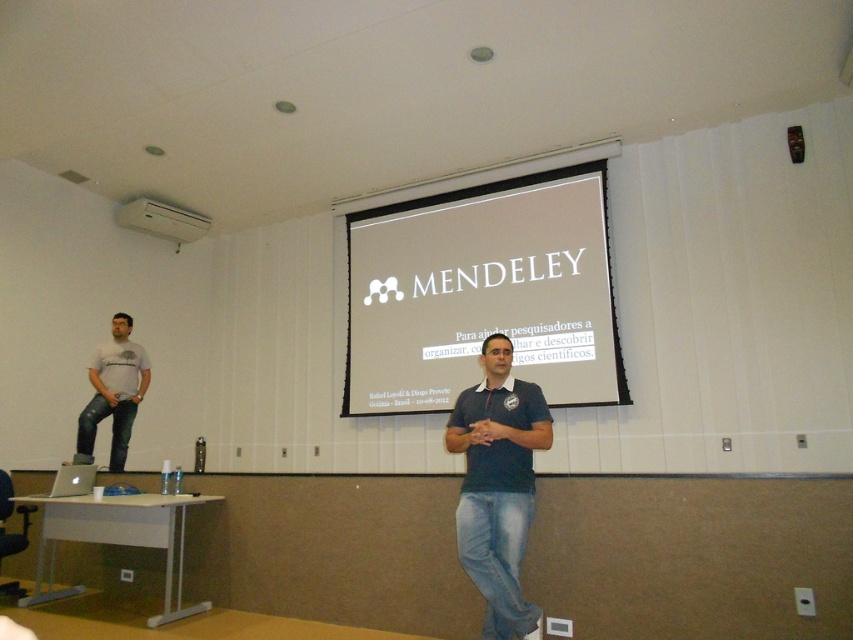
Can you confirm if dark blue shirt at center is bigger than white plastic projector at upper center?

Indeed, dark blue shirt at center has a larger size compared to white plastic projector at upper center.

Measure the distance between point (509, 561) and camera.

Point (509, 561) and camera are 10.05 feet apart.

You are a GUI agent. You are given a task and a screenshot of the screen. Output one action in this format:
    pyautogui.click(x=<x>, y=<y>)
    Task: Click on the dark blue shirt at center
    This screenshot has width=853, height=640.
    Given the screenshot: What is the action you would take?
    pyautogui.click(x=498, y=484)

Can you confirm if white matte projection screen at center is positioned above matte white t-shirt at left?

Correct, white matte projection screen at center is located above matte white t-shirt at left.

Does white matte projection screen at center have a greater height compared to matte white t-shirt at left?

Indeed, white matte projection screen at center has a greater height compared to matte white t-shirt at left.

Image resolution: width=853 pixels, height=640 pixels. What do you see at coordinates (482, 292) in the screenshot?
I see `white matte projection screen at center` at bounding box center [482, 292].

Identify the location of white matte projection screen at center. This screenshot has width=853, height=640. (482, 292).

Is point (463, 480) closer to viewer compared to point (132, 403)?

Yes.

Which of these two, dark blue shirt at center or matte white t-shirt at left, stands shorter?

With less height is matte white t-shirt at left.

Is point (502, 589) positioned behind point (99, 368)?

No, it is in front of (99, 368).

The width and height of the screenshot is (853, 640). In order to click on dark blue shirt at center in this screenshot , I will do `click(498, 484)`.